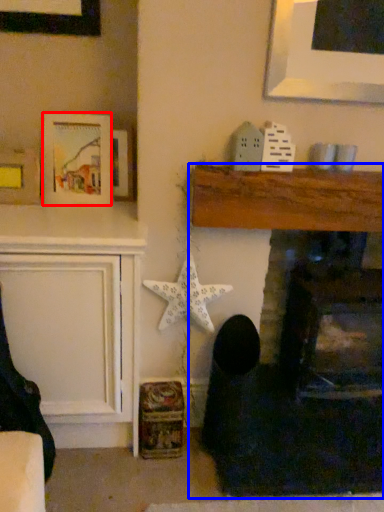
Question: Among these objects, which one is farthest to the camera, picture frame (highlighted by a red box) or fireplace (highlighted by a blue box)?

Choices:
 (A) picture frame
 (B) fireplace

Answer: (A)